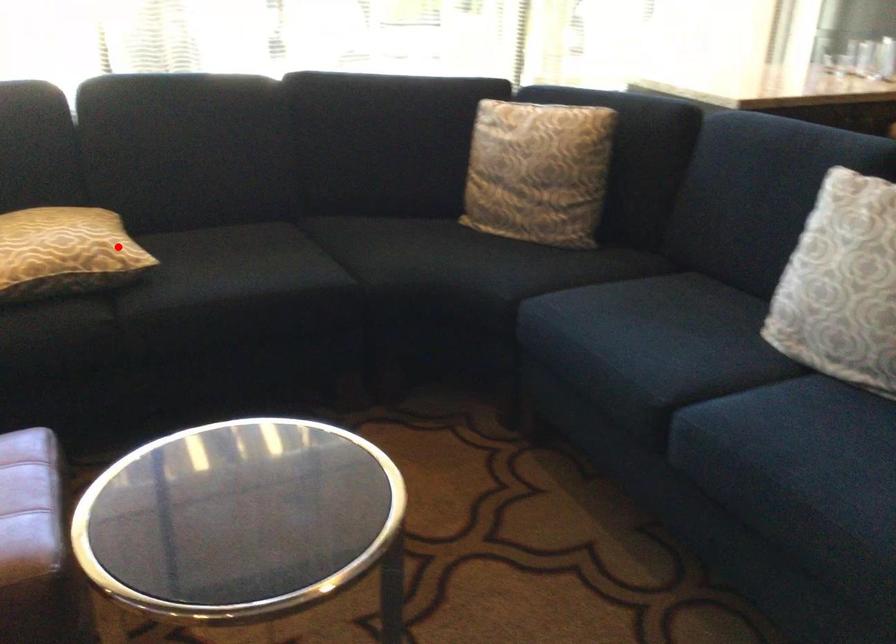
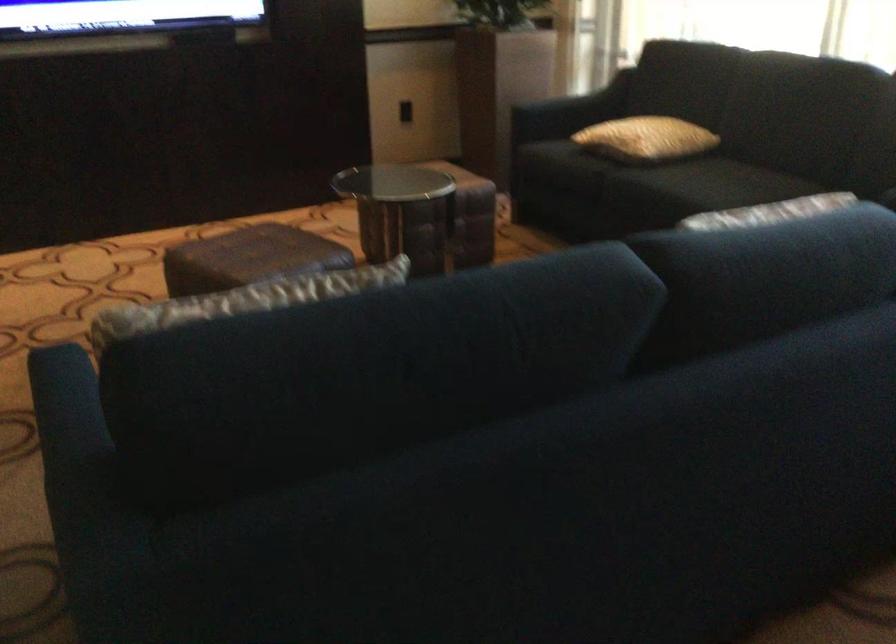
In the second image, find the point that corresponds to the highlighted location in the first image.

(645, 138)